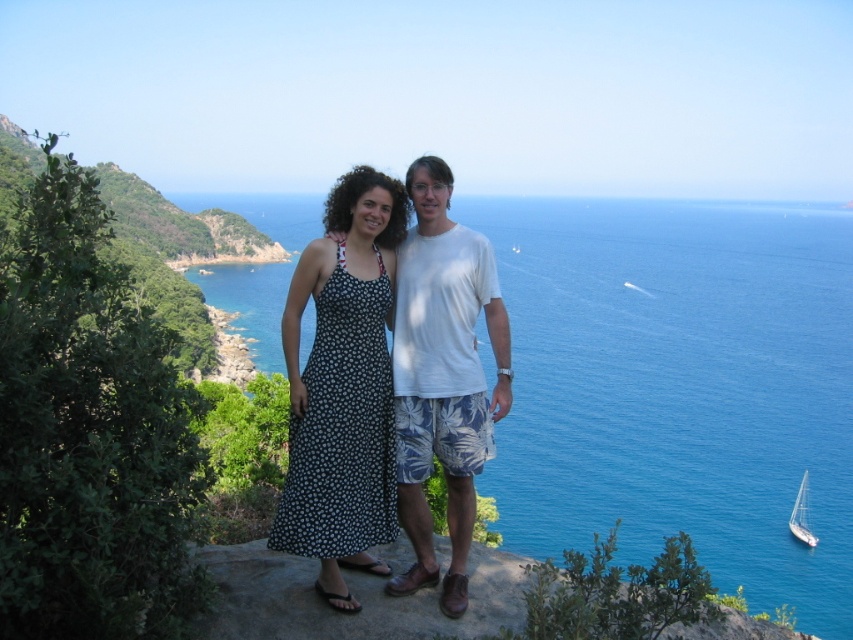
Between blue liquid water at center and white glossy sailboat at lower right, which one appears on the left side from the viewer's perspective?

blue liquid water at center

Does blue liquid water at center have a smaller size compared to white glossy sailboat at lower right?

Actually, blue liquid water at center might be larger than white glossy sailboat at lower right.

Image resolution: width=853 pixels, height=640 pixels. Find the location of `blue liquid water at center`. blue liquid water at center is located at coordinates (680, 387).

Is blue liquid water at center shorter than white cotton shirt at center?

No, blue liquid water at center is not shorter than white cotton shirt at center.

Does point (740, 204) come farther from viewer compared to point (451, 259)?

Yes, it is behind point (451, 259).

I want to click on blue liquid water at center, so pyautogui.click(x=680, y=387).

The width and height of the screenshot is (853, 640). What do you see at coordinates (343, 387) in the screenshot?
I see `black floral dress at center` at bounding box center [343, 387].

Looking at this image, who is more distant from viewer, (326, 512) or (490, 333)?

The point (490, 333) is more distant.

At what (x,y) coordinates should I click in order to perform the action: click on black floral dress at center. Please return your answer as a coordinate pair (x, y). Looking at the image, I should click on (343, 387).